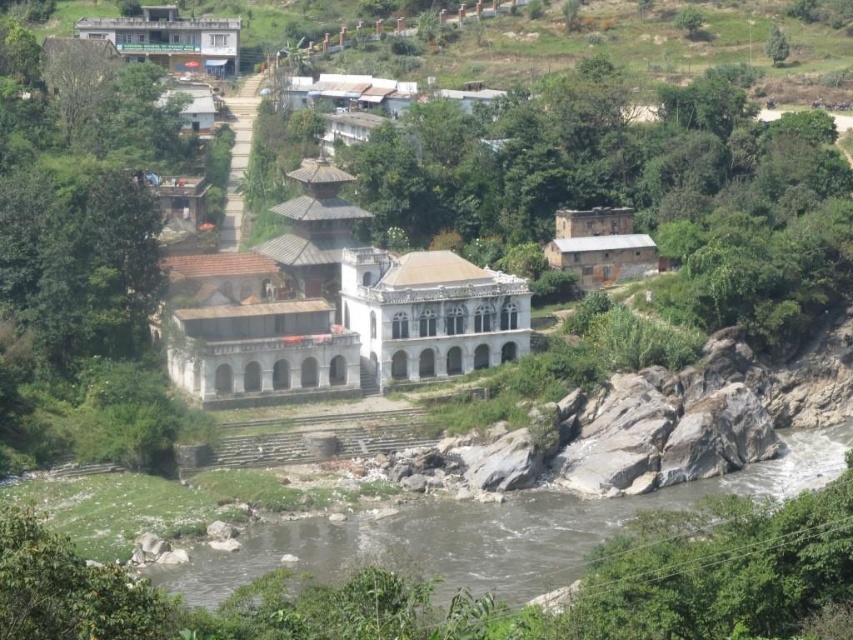
Which is behind, point (337, 236) or point (474, 557)?

The point (337, 236) is behind.

Can you confirm if white stone palace at center is positioned above brown rocky river at lower center?

Yes.

Does point (422, 316) come farther from viewer compared to point (341, 576)?

That is True.

In order to click on white stone palace at center in this screenshot , I will do `click(347, 310)`.

Is point (287, 560) in front of point (570, 225)?

Yes, point (287, 560) is in front of point (570, 225).

Describe the element at coordinates (486, 531) in the screenshot. I see `brown rocky river at lower center` at that location.

The image size is (853, 640). What are the coordinates of `brown rocky river at lower center` in the screenshot? It's located at (486, 531).

Can you confirm if white stone palace at center is shorter than white stone palace at upper center?

In fact, white stone palace at center may be taller than white stone palace at upper center.

Is white stone palace at center smaller than white stone palace at upper center?

No.

Is point (225, 264) positioned behind point (184, 35)?

No, (225, 264) is in front of (184, 35).

Find the location of a particular element. The height and width of the screenshot is (640, 853). white stone palace at center is located at coordinates (347, 310).